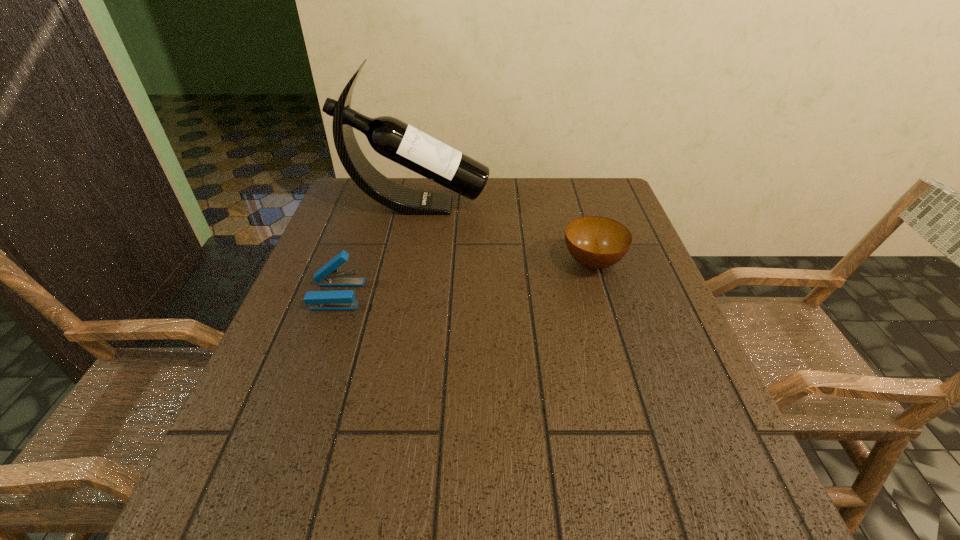
In order to click on object that is at the right edge in this screenshot , I will do `click(596, 242)`.

At what (x,y) coordinates should I click in order to perform the action: click on object situated at the far left corner. Please return your answer as a coordinate pair (x, y). This screenshot has height=540, width=960. Looking at the image, I should click on (390, 137).

In the image, there is a desktop. Identify the location of vacant space at the far edge. (452, 208).

Where is `free space at the near edge of the desktop`? free space at the near edge of the desktop is located at coordinates (389, 510).

In order to click on vacant space at the left edge of the desktop in this screenshot , I will do `click(322, 449)`.

Find the location of a particular element. The width and height of the screenshot is (960, 540). free region at the right edge is located at coordinates [x=634, y=421].

This screenshot has height=540, width=960. Identify the location of free space at the near left corner of the desktop. (225, 539).

Identify the location of free spot between the bowl and the stapler. The width and height of the screenshot is (960, 540). (465, 279).

Locate an element on the screen. Image resolution: width=960 pixels, height=540 pixels. unoccupied position between the rightmost object and the stapler is located at coordinates (465, 279).

Locate an element on the screen. vacant space that is in between the farthest object and the stapler is located at coordinates (376, 250).